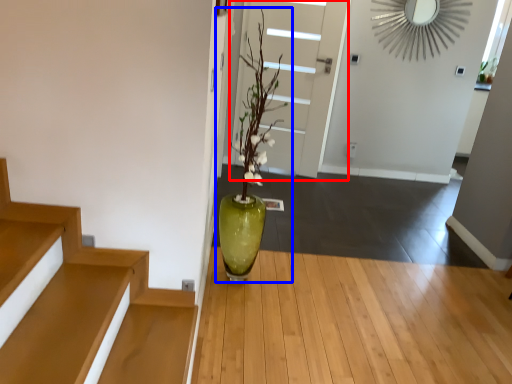
Question: Which object is closer to the camera taking this photo, door (highlighted by a red box) or houseplant (highlighted by a blue box)?

Choices:
 (A) door
 (B) houseplant

Answer: (B)